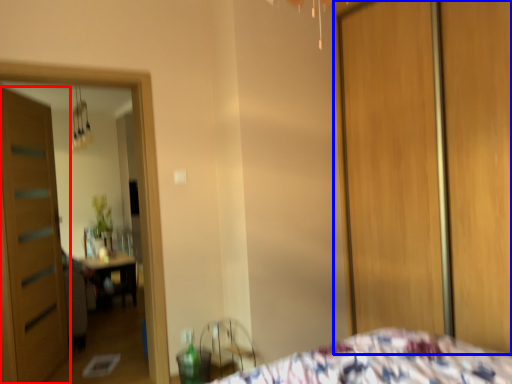
Question: Which of the following is the farthest to the observer, door (highlighted by a red box) or screen door (highlighted by a blue box)?

Choices:
 (A) door
 (B) screen door

Answer: (A)